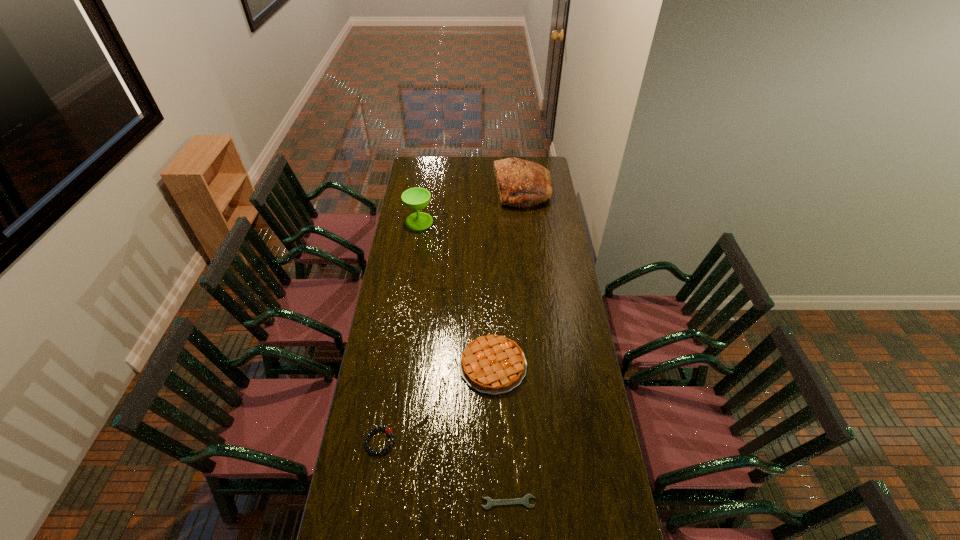
Locate an element on the screen. bread is located at coordinates (521, 183).

Find the location of a particular element. the fourth nearest object is located at coordinates (417, 198).

At what (x,y) coordinates should I click in order to perform the action: click on pie. Please return your answer as a coordinate pair (x, y). Image resolution: width=960 pixels, height=540 pixels. Looking at the image, I should click on (492, 364).

Identify the location of the third shortest object. click(x=492, y=364).

Image resolution: width=960 pixels, height=540 pixels. I want to click on the second shortest object, so click(388, 430).

Find the location of a particular element. Image resolution: width=960 pixels, height=540 pixels. the second nearest object is located at coordinates (388, 430).

Locate an element on the screen. the nearest object is located at coordinates (524, 501).

Where is `wrench`? This screenshot has width=960, height=540. wrench is located at coordinates (524, 501).

I want to click on vacant position located 0.380m at the sliced front of the farthest object, so click(x=431, y=191).

At what (x,y) coordinates should I click in order to perform the action: click on free space located at the sliced front of the farthest object. Please return your answer as a coordinate pair (x, y). Looking at the image, I should click on (436, 191).